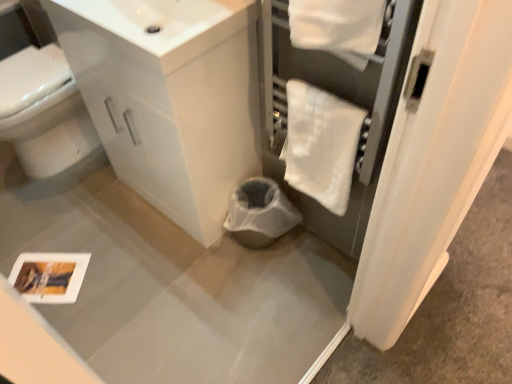
Question: In terms of size, does white glossy bidet at left appear bigger or smaller than white glossy sink at upper center?

Choices:
 (A) small
 (B) big

Answer: (B)

Question: Is white glossy bidet at left inside or outside of white glossy sink at upper center?

Choices:
 (A) outside
 (B) inside

Answer: (A)

Question: Considering the real-world distances, which object is farthest from the white glossy bidet at left?

Choices:
 (A) white fluffy bath towel at upper right
 (B) white glossy sink at upper center

Answer: (A)

Question: Which object is positioned farthest from the white glossy bidet at left?

Choices:
 (A) white fluffy bath towel at upper right
 (B) white glossy sink at upper center

Answer: (A)